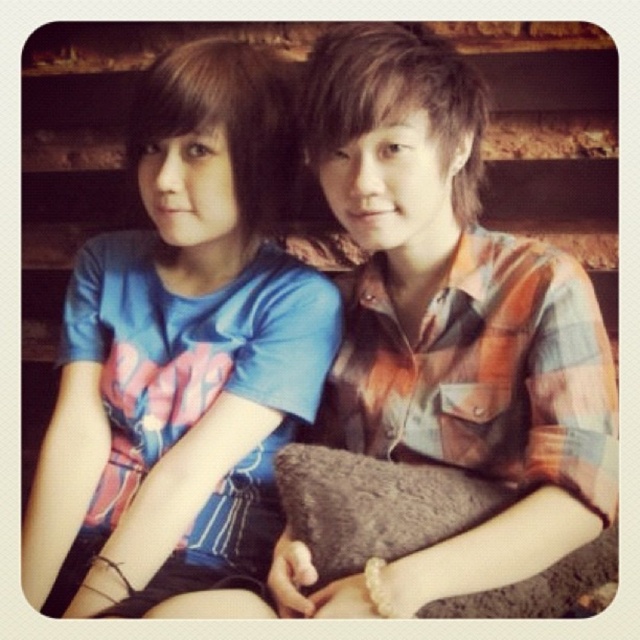
Consider the image. You are a photographer trying to capture a clear shot of the plaid shirt at center and the brown fuzzy pillow at center. Since both are at the center, which one is closer to the camera?

The plaid shirt at center is in front of the brown fuzzy pillow at center, so it is closer to the camera.

You are a photographer setting up for a portrait and need to ensure the subjects are properly framed. Given the scene described, which object, the plaid shirt at center or the brown fuzzy pillow at center, should be placed to the right side if you want to align them with the natural flow of the image?

The plaid shirt at center is positioned on the left side of the brown fuzzy pillow at center, so to align with the natural flow, the brown fuzzy pillow at center should be placed to the right side.

You are standing at the camera position and want to place a small gift exactly at point (202, 330). If you can reach out 3 feet, can you reach that point?

The point (202, 330) is 3.65 feet away from the camera. Since your reach is only 3 feet, you cannot reach it.